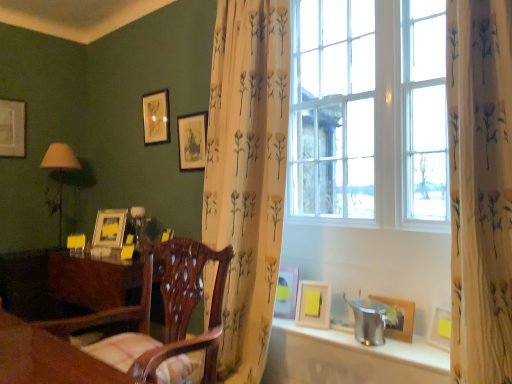
At what (x,y) coordinates should I click in order to perform the action: click on free spot in front of wooden picture frame at lower right, arranged as the 7th picture frame when viewed from the back. Please return your answer as a coordinate pair (x, y). The height and width of the screenshot is (384, 512). Looking at the image, I should click on (406, 350).